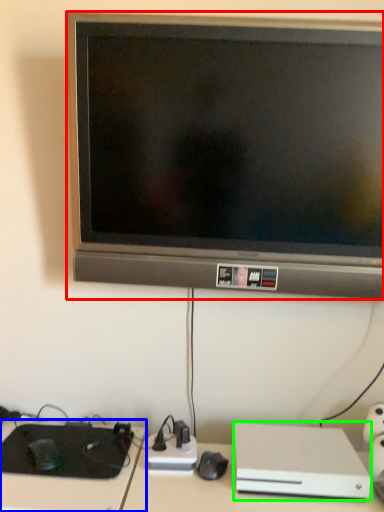
Question: Based on their relative distances, which object is farther from television (highlighted by a red box)? Choose from computer desk (highlighted by a blue box) and computer (highlighted by a green box).

Choices:
 (A) computer desk
 (B) computer

Answer: (A)